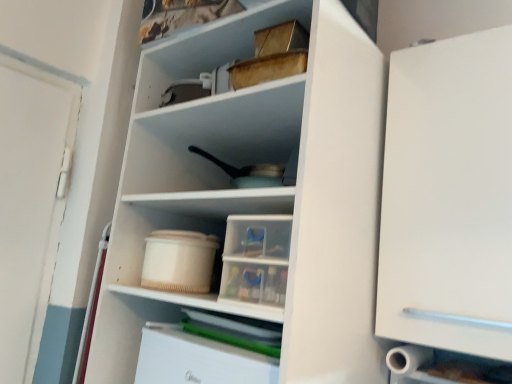
Question: Does point (163, 231) appear closer or farther from the camera than point (155, 43)?

Choices:
 (A) closer
 (B) farther

Answer: (A)

Question: From the image's perspective, relative to wooden box at upper center, is beige plastic container at center above or below?

Choices:
 (A) above
 (B) below

Answer: (B)

Question: Which of these objects is positioned closest to the white plastic drawer at lower center, which is the 1th cabinetry from left to right?

Choices:
 (A) white matte cabinet at right, positioned as the first cabinetry in right-to-left order
 (B) wooden box at upper center
 (C) beige plastic container at center

Answer: (C)

Question: Which object is the closest to the beige plastic container at center?

Choices:
 (A) wooden box at upper center
 (B) white plastic drawer at lower center, which is the 2th cabinetry from right to left
 (C) white matte cabinet at right, marked as the second cabinetry in a left-to-right arrangement

Answer: (B)